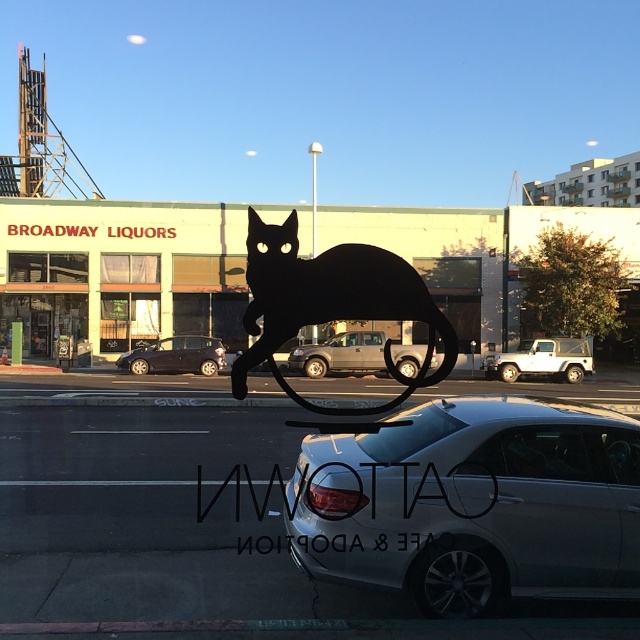
Question: Which object is the closest to the dark blue matte car at center-left?

Choices:
 (A) black matte cat at center
 (B) satin silver sedan at center
 (C) white matte suv at center

Answer: (A)

Question: Can you confirm if white matte suv at center is thinner than dark blue matte car at center-left?

Choices:
 (A) yes
 (B) no

Answer: (A)

Question: Based on their relative distances, which object is nearer to the dark blue matte car at center-left?

Choices:
 (A) white matte suv at center
 (B) black matte cat at center
 (C) satin silver sedan at center
 (D) silver metallic suv at center

Answer: (D)

Question: Can you confirm if black matte cat at center is wider than white matte suv at center?

Choices:
 (A) yes
 (B) no

Answer: (A)

Question: Is black matte cat at center to the left of white matte suv at center from the viewer's perspective?

Choices:
 (A) yes
 (B) no

Answer: (A)

Question: Which of the following is the farthest from the observer?

Choices:
 (A) coord(548,369)
 (B) coord(461,451)

Answer: (A)